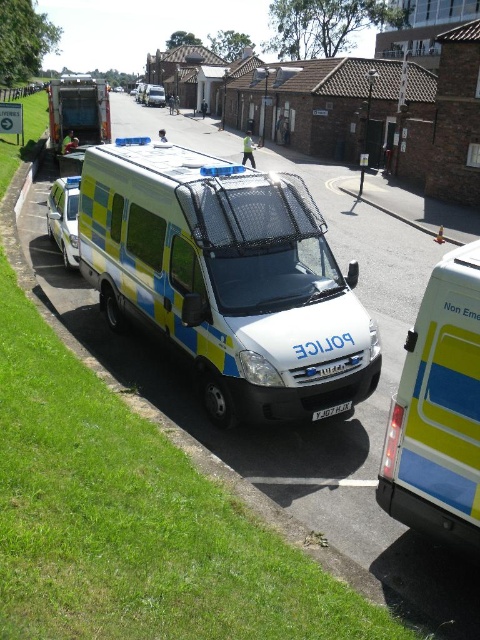
Question: Which point is closer to the camera?

Choices:
 (A) blue and yellow painted police van at center
 (B) blue and yellow painted van at left
 (C) yellow and blue plastic van at right
 (D) blue and yellow painted van at center

Answer: (C)

Question: Where is yellow and blue plastic van at right located in relation to blue and yellow painted van at center in the image?

Choices:
 (A) right
 (B) left

Answer: (A)

Question: Is blue and yellow painted van at left positioned before blue and yellow painted van at center?

Choices:
 (A) yes
 (B) no

Answer: (A)

Question: Estimate the real-world distances between objects in this image. Which object is farther from the blue and yellow painted van at center?

Choices:
 (A) blue and yellow painted van at left
 (B) blue and yellow painted police van at center

Answer: (B)

Question: Observing the image, what is the correct spatial positioning of yellow and blue plastic van at right in reference to blue and yellow painted van at center?

Choices:
 (A) right
 (B) left

Answer: (A)

Question: Which point is closer to the camera taking this photo?

Choices:
 (A) (156, 104)
 (B) (470, 268)
 (C) (92, 93)
 (D) (163, 304)

Answer: (B)